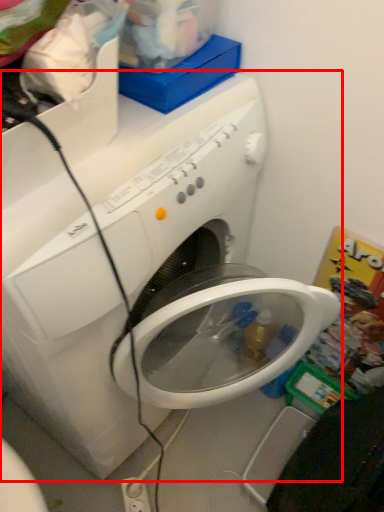
Question: Considering the relative positions of washing machine (annotated by the red box) and electric outlet in the image provided, where is washing machine (annotated by the red box) located with respect to the staircase?

Choices:
 (A) left
 (B) right

Answer: (A)